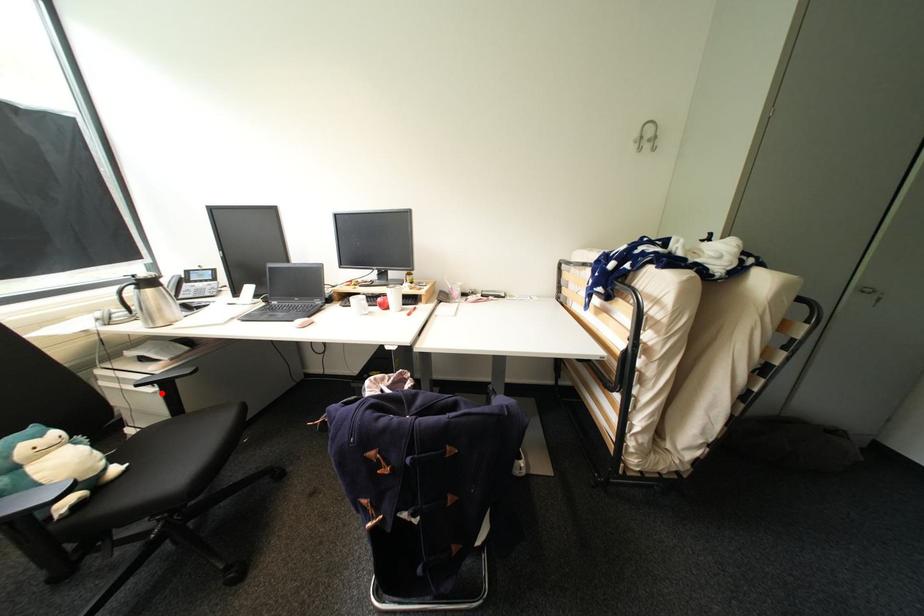
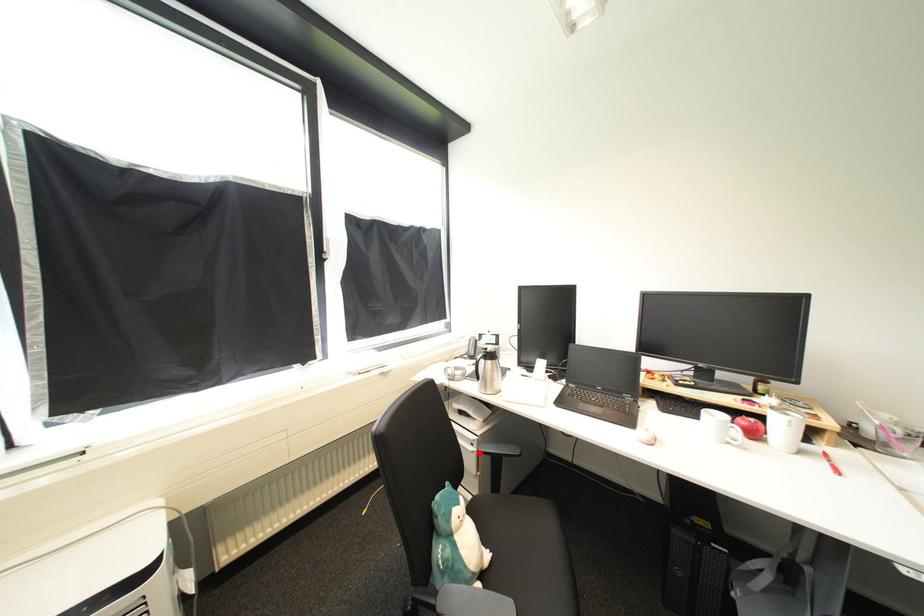
I am providing you with two images of the same scene from different viewpoints. A red point is marked on the first image and another point is marked on the second image. Is the marked point in image1 the same physical position as the marked point in image2?

Yes